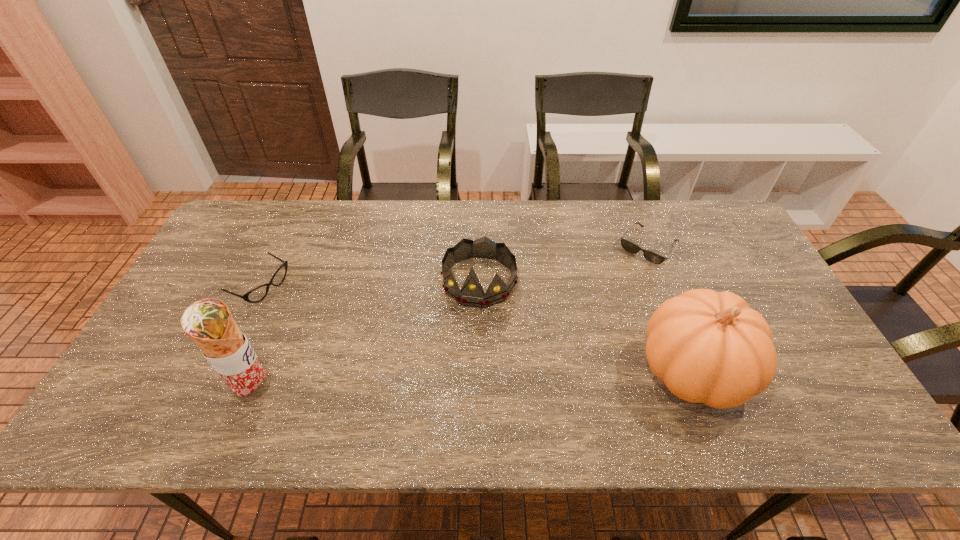
Identify the location of burrito. The image size is (960, 540). (208, 322).

Locate an element on the screen. This screenshot has width=960, height=540. pumpkin is located at coordinates (709, 347).

Locate an element on the screen. The height and width of the screenshot is (540, 960). the third tallest object is located at coordinates point(472,294).

Locate an element on the screen. The width and height of the screenshot is (960, 540). the third object from left to right is located at coordinates (472, 294).

Find the location of `sunglasses`. sunglasses is located at coordinates (655, 258).

The height and width of the screenshot is (540, 960). Identify the location of the fourth tallest object. (257, 294).

Locate an element on the screen. free spot located on the back of the burrito is located at coordinates (294, 291).

Where is `vacant space located 0.360m on the left of the pumpkin`? vacant space located 0.360m on the left of the pumpkin is located at coordinates (491, 370).

In order to click on free point located 0.180m at the front of the third shortest object with jewels in this screenshot , I will do `click(459, 365)`.

Where is `vacant space located at the front of the third shortest object with jewels`? vacant space located at the front of the third shortest object with jewels is located at coordinates (459, 365).